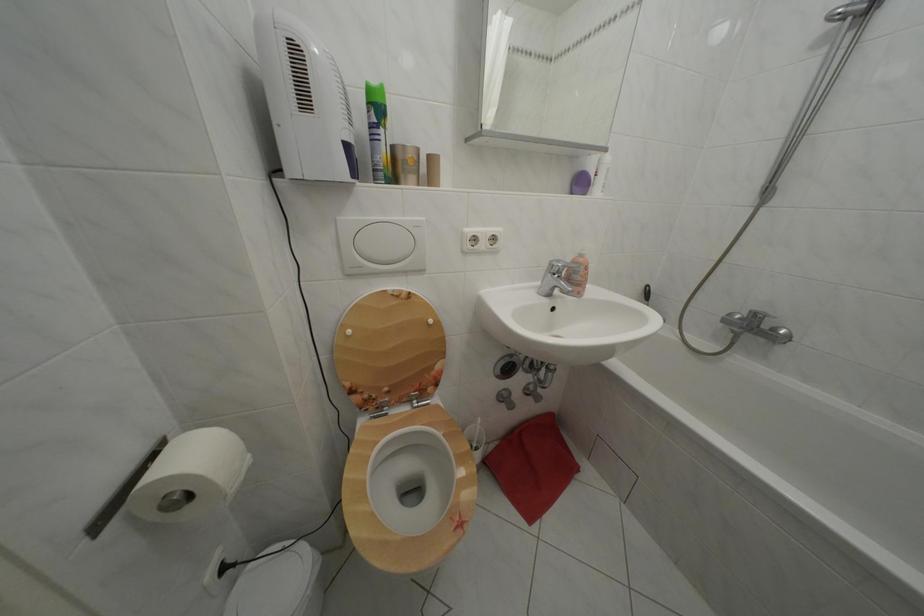
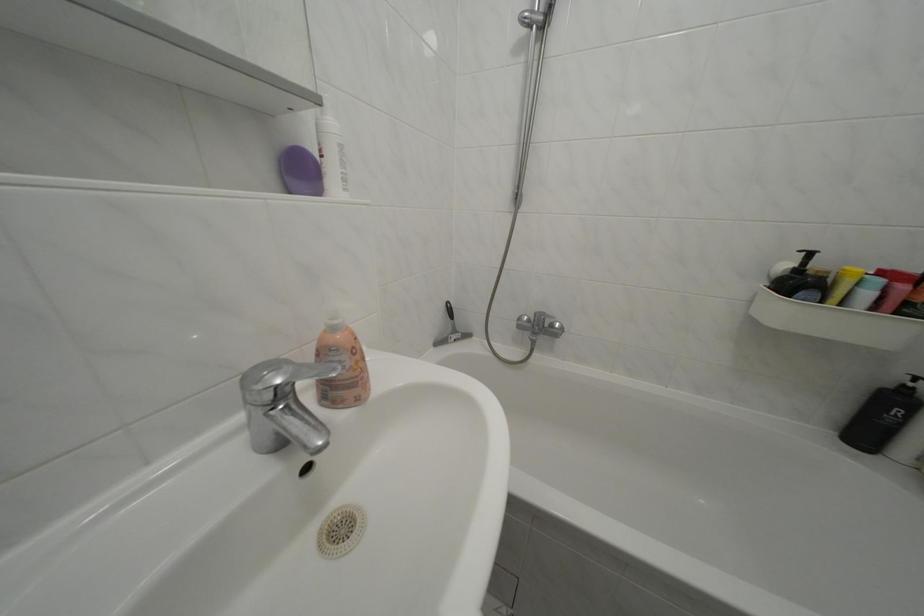
Question: The first image is from the beginning of the video and the second image is from the end. How did the camera likely rotate when shooting the video?

Choices:
 (A) Left
 (B) Right
 (C) Up
 (D) Down

Answer: (B)